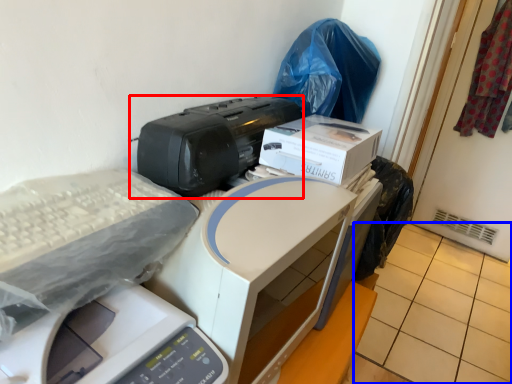
Question: Which object is closer to the camera taking this photo, printer (highlighted by a red box) or tile (highlighted by a blue box)?

Choices:
 (A) printer
 (B) tile

Answer: (A)